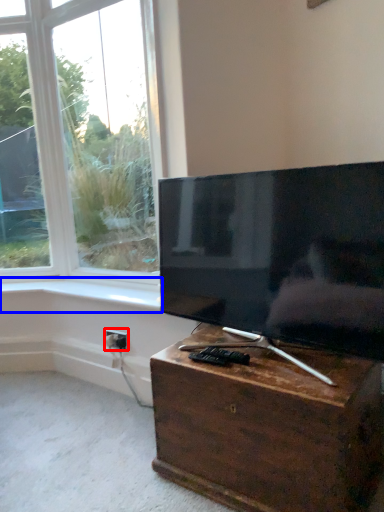
Question: Which point is closer to the camera, electric outlet (highlighted by a red box) or window sill (highlighted by a blue box)?

Choices:
 (A) electric outlet
 (B) window sill

Answer: (B)